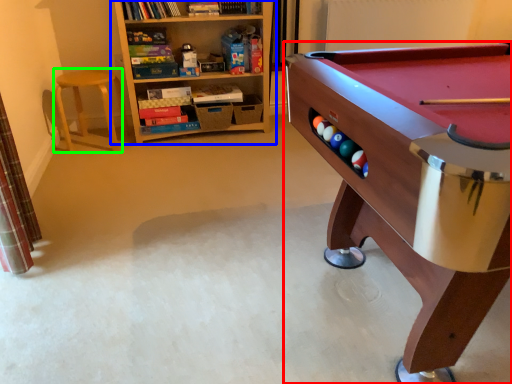
Question: Estimate the real-world distances between objects in this image. Which object is farther from table (highlighted by a red box), bookcase (highlighted by a blue box) or stool (highlighted by a green box)?

Choices:
 (A) bookcase
 (B) stool

Answer: (B)